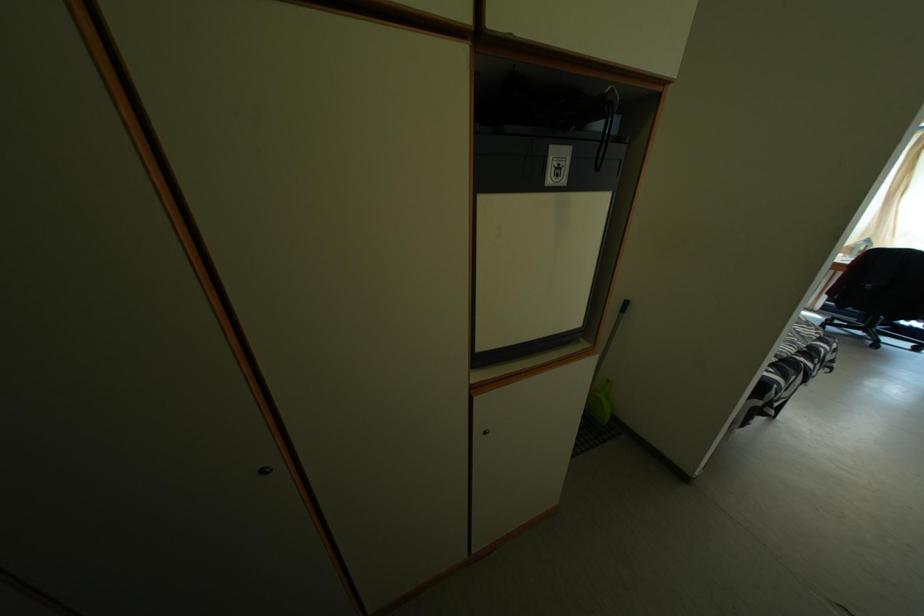
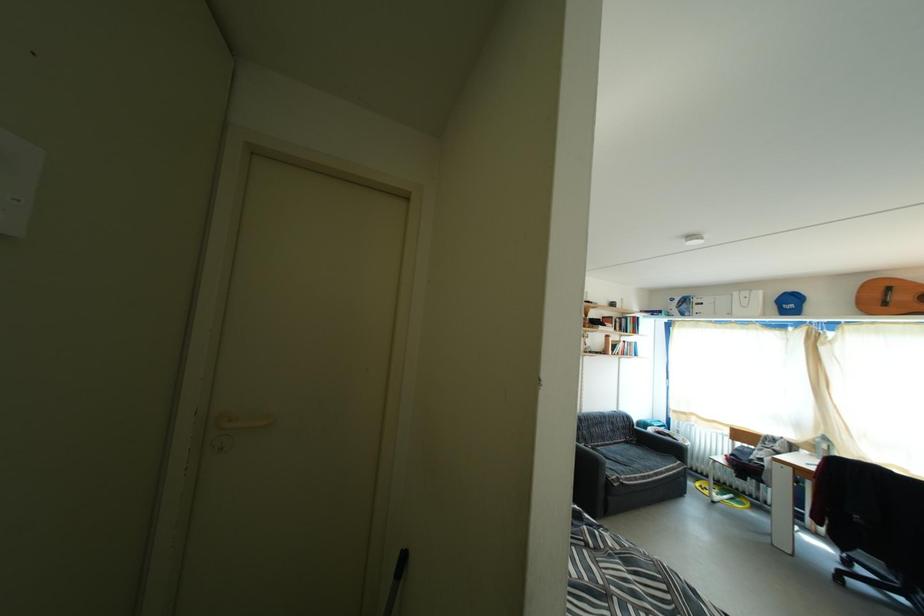
Question: Which direction would the cameraman need to move to produce the second image? Reply with the corresponding letter.

Choices:
 (A) Left
 (B) Right
 (C) Forward
 (D) Backward

Answer: (B)